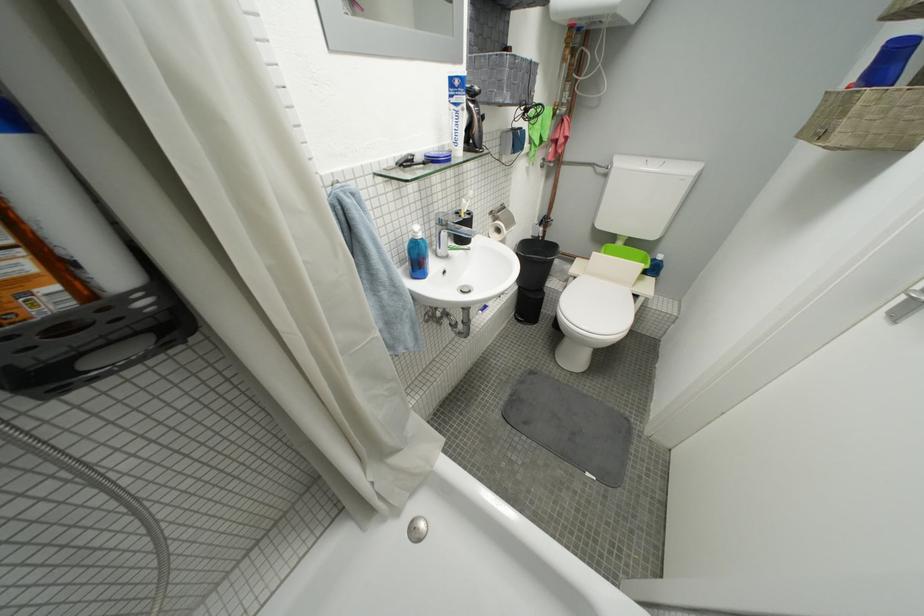
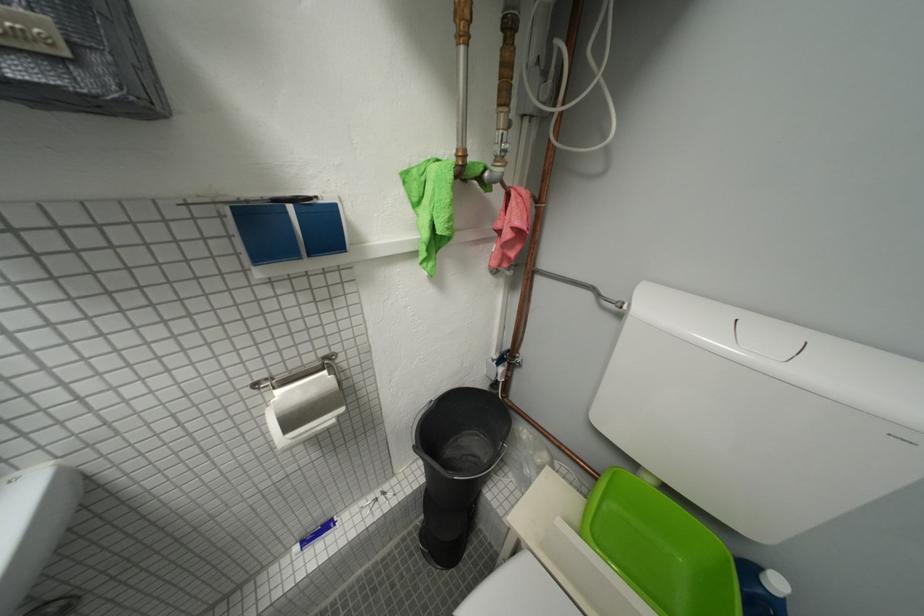
Which direction would the cameraman need to move to produce the second image?

The cameraman moved toward right, forward.